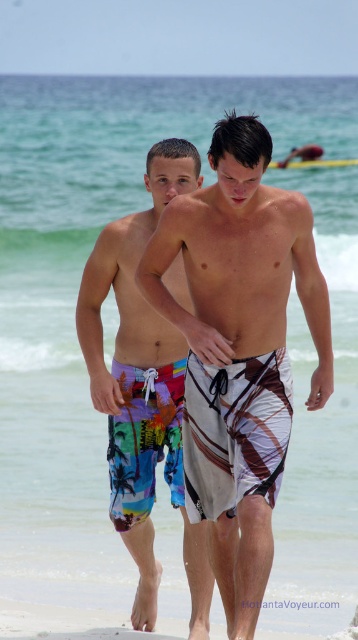
Question: Which point is closer to the camera taking this photo?

Choices:
 (A) (44, 618)
 (B) (114, 349)

Answer: (A)

Question: Which of the following is the closest to the observer?

Choices:
 (A) (161, 454)
 (B) (160, 628)

Answer: (A)

Question: Which point is farther to the camera?

Choices:
 (A) white sand at lower center
 (B) multicolored printed boardshorts at left

Answer: (B)

Question: Can you confirm if multicolored printed boardshorts at left is positioned above white sand at lower center?

Choices:
 (A) yes
 (B) no

Answer: (A)

Question: From the image, what is the correct spatial relationship of multicolored printed boardshorts at left in relation to white sand at lower center?

Choices:
 (A) above
 (B) below

Answer: (A)

Question: Can you confirm if multicolored printed boardshorts at left is positioned to the right of white sand at lower center?

Choices:
 (A) no
 (B) yes

Answer: (B)